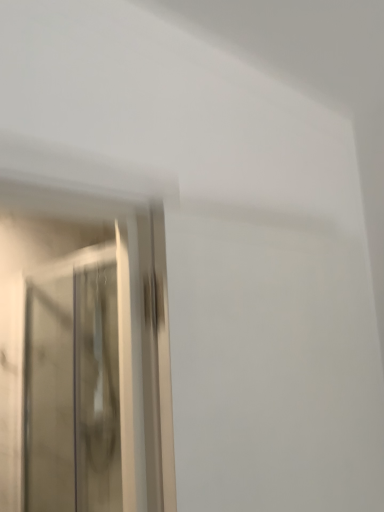
This screenshot has width=384, height=512. What do you see at coordinates (84, 356) in the screenshot?
I see `metallic glass door at left` at bounding box center [84, 356].

Locate an element on the screen. This screenshot has width=384, height=512. metallic glass door at left is located at coordinates (84, 356).

Find the location of a particular element. metallic glass door at left is located at coordinates (84, 356).